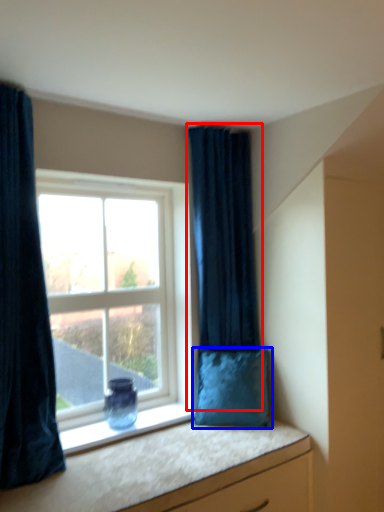
Question: Which object appears farthest to the camera in this image, curtain (highlighted by a red box) or pillow (highlighted by a blue box)?

Choices:
 (A) curtain
 (B) pillow

Answer: (A)